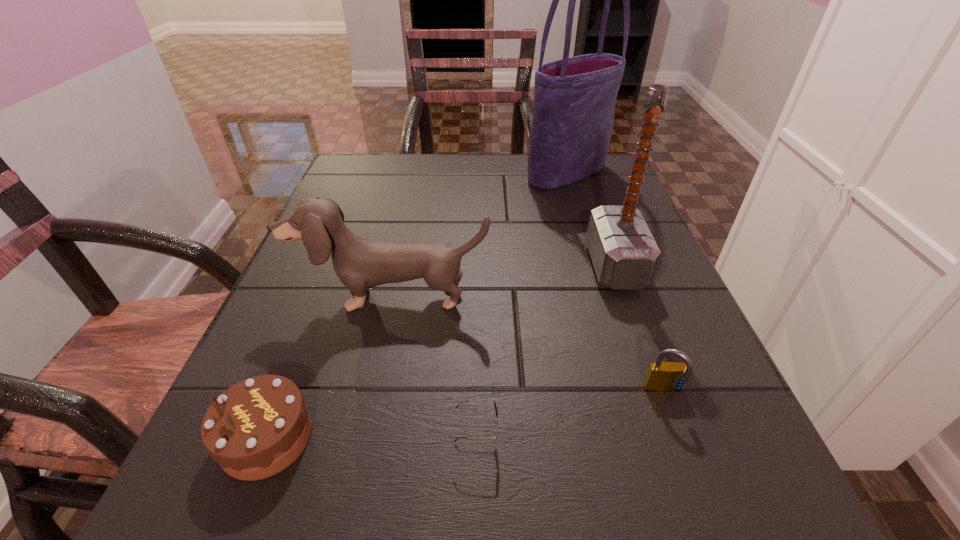
Image resolution: width=960 pixels, height=540 pixels. In order to click on free space at the far right corner of the desktop in this screenshot , I will do `click(572, 192)`.

Locate an element on the screen. The width and height of the screenshot is (960, 540). free space between the third tallest object and the hammer is located at coordinates (503, 282).

The image size is (960, 540). What are the coordinates of `empty location between the chocolate cake and the fifth shortest object` in the screenshot? It's located at (441, 352).

Identify the location of empty space between the padlock and the puppy. The width and height of the screenshot is (960, 540). (527, 345).

Identify the location of unoccupied area between the tallest object and the shortest object. (522, 306).

This screenshot has width=960, height=540. Identify the location of vacant space that is in between the shortest object and the hammer. (546, 352).

Locate an element on the screen. Image resolution: width=960 pixels, height=540 pixels. empty space between the padlock and the puppy is located at coordinates (527, 345).

The height and width of the screenshot is (540, 960). In order to click on vacant area that lies between the puppy and the second tallest object in this screenshot , I will do click(503, 282).

Where is `vacant space in between the chocolate cake and the padlock`? vacant space in between the chocolate cake and the padlock is located at coordinates (466, 415).

Locate an element on the screen. object that is the third closest one to the puppy is located at coordinates (624, 254).